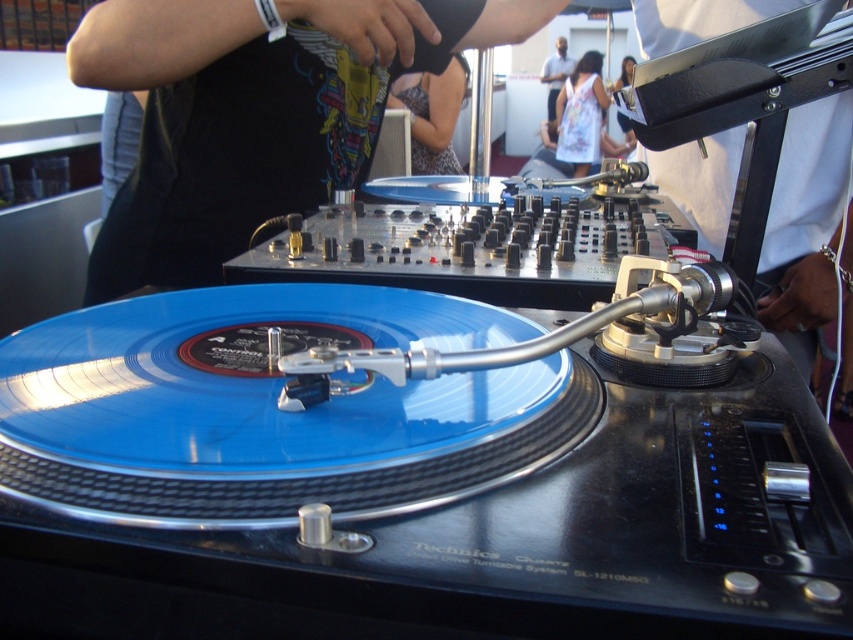
You are a photographer at the event and want to capture a photo focusing on the DJ setup. You notice the patterned fabric dress at center and the dark blue shirt at upper center in the frame. Which clothing item will appear larger in the photo?

The patterned fabric dress at center will appear larger in the photo because it is closer to the viewer than the dark blue shirt at upper center.

You are a photographer aiming to capture a closeup of the metallic silver microphone at upper center without the patterned fabric dress at center appearing in the foreground. Is this possible given their positions?

The patterned fabric dress at center is closer to the viewer than the metallic silver microphone at upper center, so it will block the microphone in the foreground. To avoid this, you need to adjust your angle or move the dress.